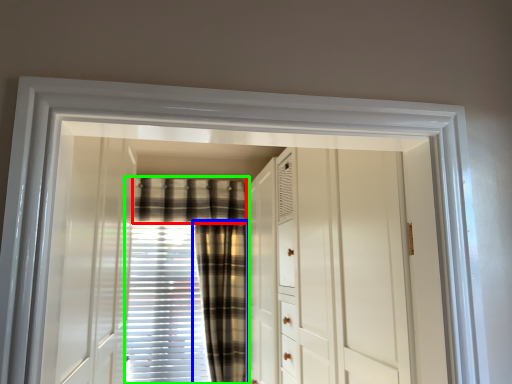
Question: Which object is positioned closest to plaid (highlighted by a red box)? Select from curtain (highlighted by a blue box) and curtain (highlighted by a green box).

Choices:
 (A) curtain
 (B) curtain

Answer: (B)